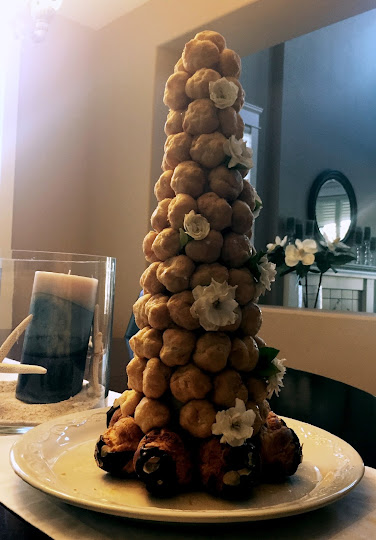
At what (x,y) coordinates should I click in order to perform the action: click on candle. Please return your answer as a coordinate pair (x, y). The height and width of the screenshot is (540, 376). Looking at the image, I should click on (67, 330).